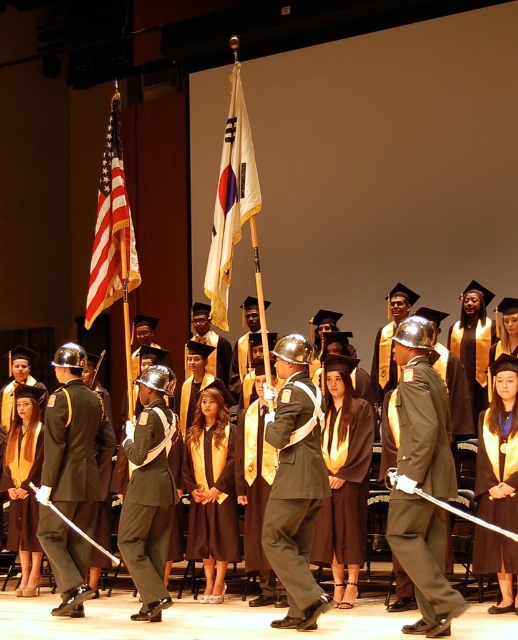
Question: Can you confirm if khaki fabric uniform at center is thinner than shiny black uniform at center?

Choices:
 (A) no
 (B) yes

Answer: (B)

Question: Does khaki fabric uniform at center have a larger size compared to white fabric flag at center?

Choices:
 (A) yes
 (B) no

Answer: (B)

Question: Estimate the real-world distances between objects in this image. Which object is closer to the satin black uniform at center?

Choices:
 (A) black matte graduation gown at lower right
 (B) shiny silver helmet at center
 (C) dark gray fabric uniform at center

Answer: (C)

Question: Which point is closer to the camera?

Choices:
 (A) dark gray fabric uniform at center
 (B) shiny silver helmet at center
 (C) khaki fabric uniform at center

Answer: (C)

Question: Observing the image, what is the correct spatial positioning of dark gray fabric uniform at center in reference to matte fabric flag at left?

Choices:
 (A) right
 (B) left

Answer: (A)

Question: Among these points, which one is farthest from the camera?

Choices:
 (A) (127, 241)
 (B) (44, 458)
 (C) (284, 502)

Answer: (A)